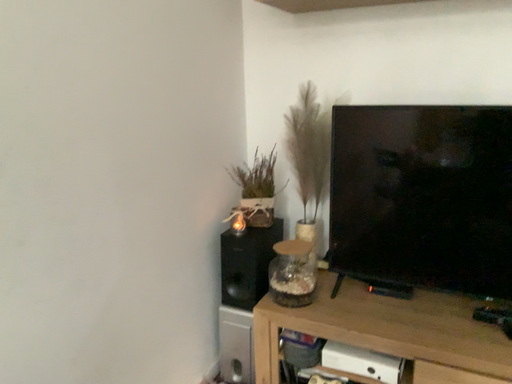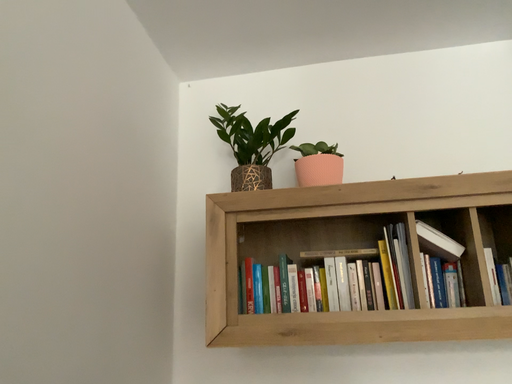
Question: Which way did the camera rotate in the video?

Choices:
 (A) rotated left
 (B) rotated right

Answer: (B)